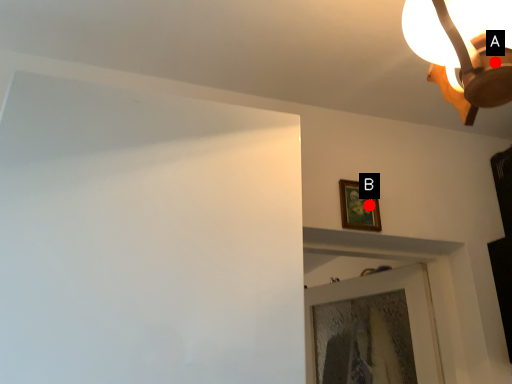
Question: Two points are circled on the image, labeled by A and B beside each circle. Which point is closer to the camera taking this photo?

Choices:
 (A) A is closer
 (B) B is closer

Answer: (A)